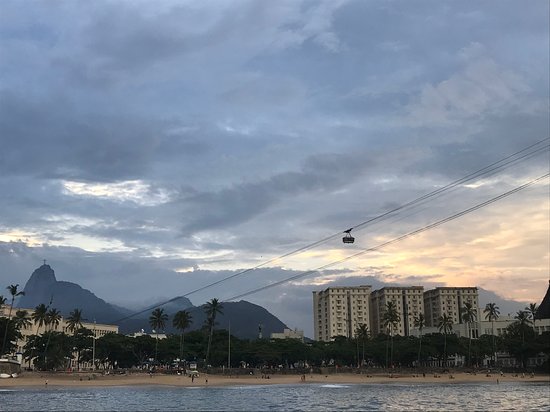
Locate an element on the screen. The width and height of the screenshot is (550, 412). statue is located at coordinates (43, 262).